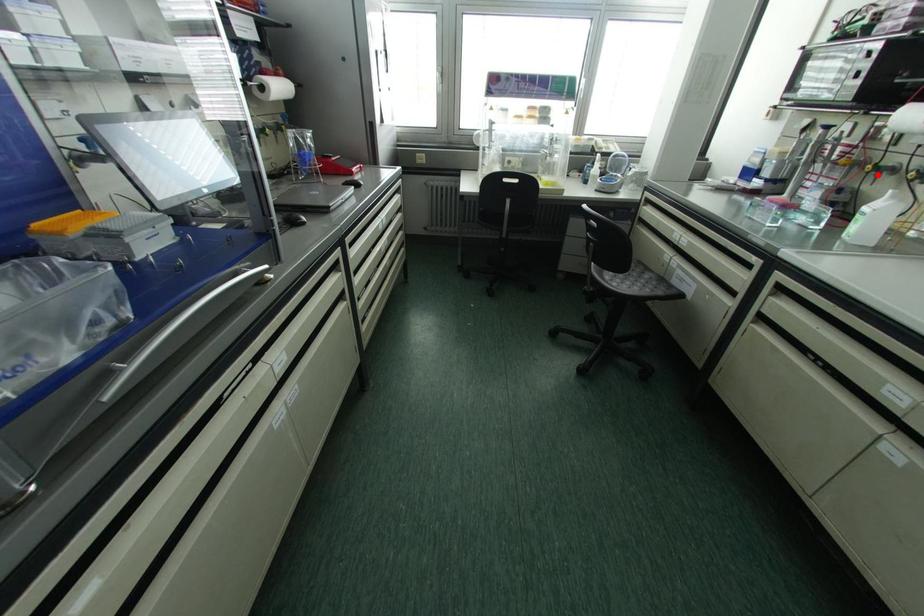
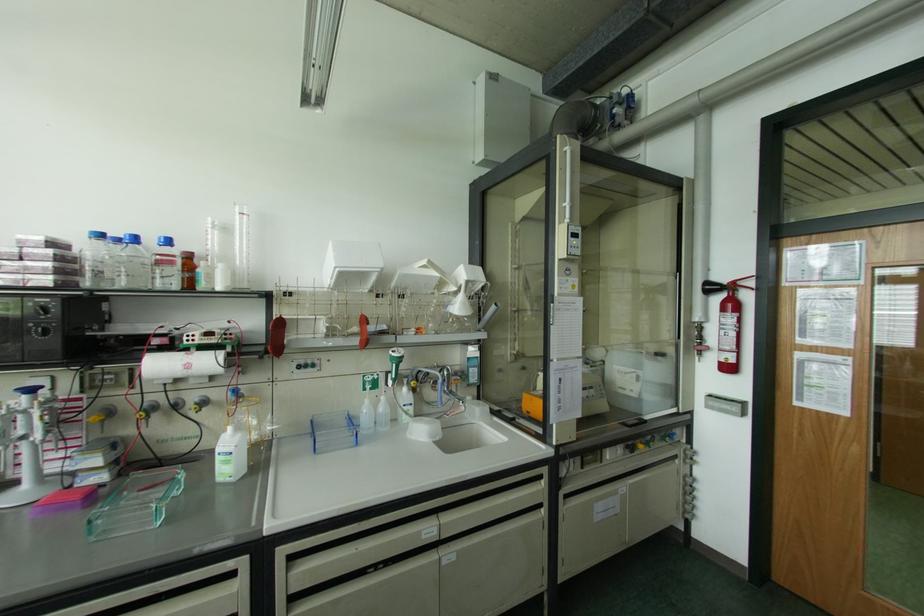
Question: A red point is marked in image1. In image2, is the corresponding 3D point closer to the camera or farther? Reply with the corresponding letter.

Choices:
 (A) The corresponding 3D point is closer.
 (B) The corresponding 3D point is farther.

Answer: (A)